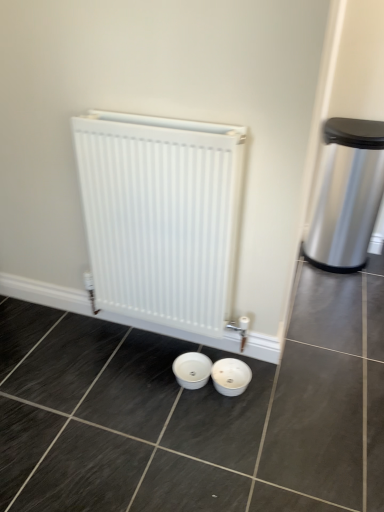
The height and width of the screenshot is (512, 384). I want to click on vacant space behind white glossy basin at center, so click(232, 355).